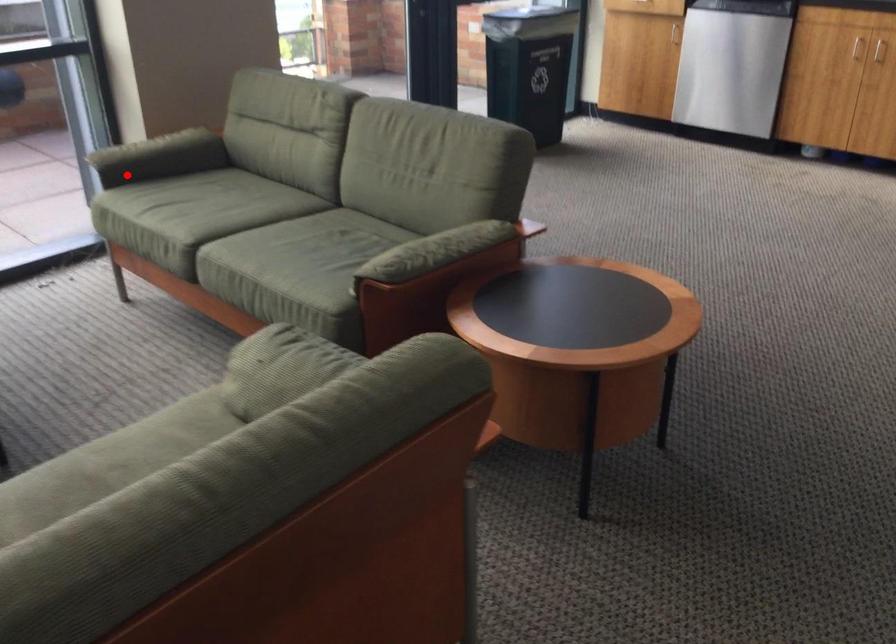
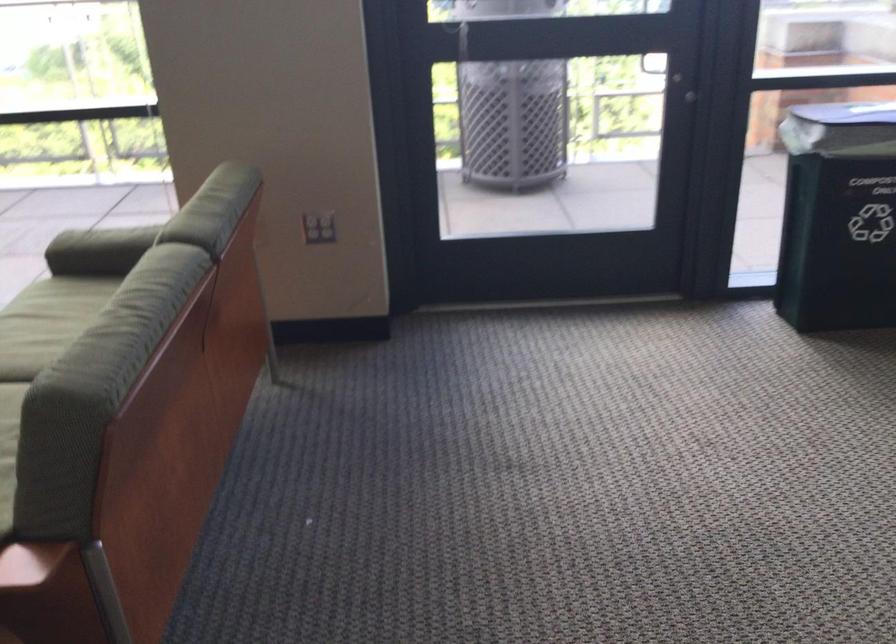
Where in the second image is the point corresponding to the highlighted location from the first image?

(99, 247)